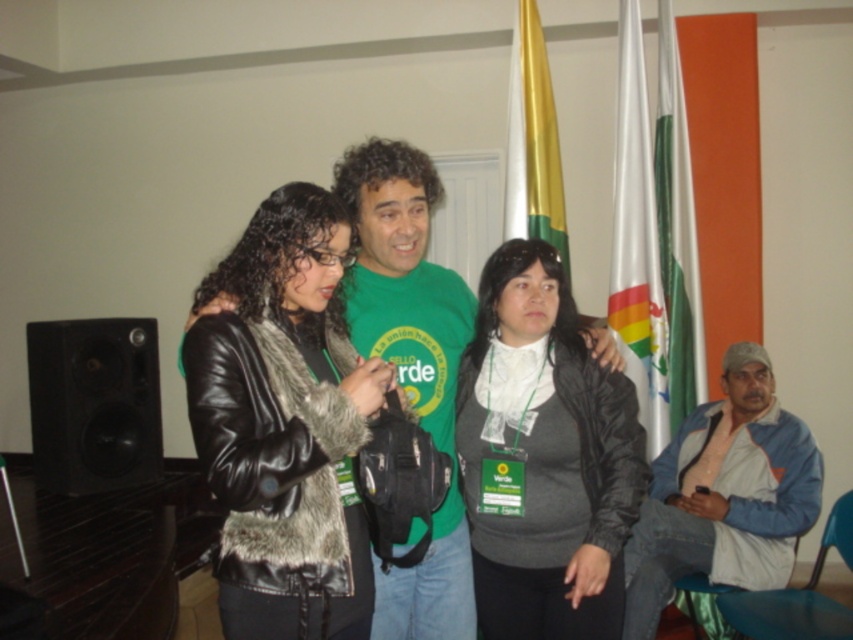
Question: Considering the relative positions of green matte shirt at center and white fabric flag at upper right in the image provided, where is green matte shirt at center located with respect to white fabric flag at upper right?

Choices:
 (A) right
 (B) left

Answer: (B)

Question: Estimate the real-world distances between objects in this image. Which object is closer to the gold shiny flag at upper center?

Choices:
 (A) matte black jacket at center
 (B) black matte speaker at lower left

Answer: (A)

Question: Does black matte speaker at lower left come in front of gold shiny flag at upper center?

Choices:
 (A) yes
 (B) no

Answer: (B)

Question: Does matte black jacket at center appear on the left side of denim jacket at lower right?

Choices:
 (A) no
 (B) yes

Answer: (B)

Question: Which point is farther to the camera?

Choices:
 (A) green fabric flag at right
 (B) denim jacket at lower right
 (C) leather fur vest at center
 (D) matte black jacket at center

Answer: (A)

Question: Which object is closer to the camera taking this photo?

Choices:
 (A) matte black jacket at center
 (B) green matte shirt at center

Answer: (A)